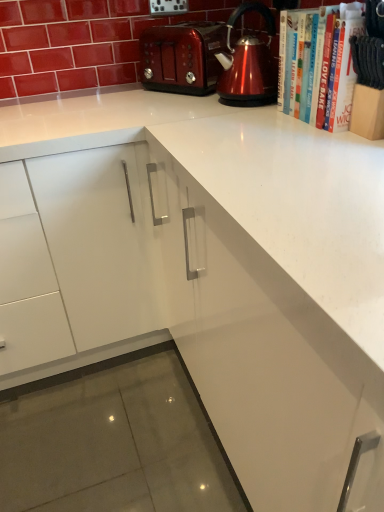
In order to click on white paper book at upper right, arranged as the first book when viewed from the front in this screenshot , I will do `click(343, 67)`.

At what (x,y) coordinates should I click in order to perform the action: click on shiny metallic toaster at upper center. Please return your answer as a coordinate pair (x, y). This screenshot has width=384, height=512. Looking at the image, I should click on (182, 57).

Where is `white paper book at upper right, the second book viewed from the back`? The image size is (384, 512). white paper book at upper right, the second book viewed from the back is located at coordinates (343, 67).

From the image's perspective, is white paper book at upper right, placed as the second book when sorted from front to back, beneath shiny metallic kettle at upper right?

Yes, from the image's perspective, white paper book at upper right, placed as the second book when sorted from front to back, is beneath shiny metallic kettle at upper right.

Is point (352, 24) positioned behind point (243, 104)?

No, it is in front of (243, 104).

Considering the positions of objects white paper book at upper right, placed as the second book when sorted from front to back, and shiny metallic kettle at upper right in the image provided, who is in front, white paper book at upper right, placed as the second book when sorted from front to back, or shiny metallic kettle at upper right?

white paper book at upper right, placed as the second book when sorted from front to back, is more forward.

Considering the sizes of objects white paper book at upper right, placed as the second book when sorted from front to back, and shiny metallic kettle at upper right in the image provided, who is taller, white paper book at upper right, placed as the second book when sorted from front to back, or shiny metallic kettle at upper right?

shiny metallic kettle at upper right.

Is white paper book at upper right, arranged as the 1th book when viewed from the back, at the left side of white paper book at upper right, the second book viewed from the back?

Indeed, white paper book at upper right, arranged as the 1th book when viewed from the back, is positioned on the left side of white paper book at upper right, the second book viewed from the back.

From the image's perspective, is white paper book at upper right, arranged as the 1th book when viewed from the back, located above or below white paper book at upper right, the second book viewed from the back?

Clearly, from the image's perspective, white paper book at upper right, arranged as the 1th book when viewed from the back, is above white paper book at upper right, the second book viewed from the back.

Does white paper book at upper right, placed as the second book when sorted from front to back, lie in front of white paper book at upper right, arranged as the first book when viewed from the front?

No, it is behind white paper book at upper right, arranged as the first book when viewed from the front.

This screenshot has height=512, width=384. Find the location of `book on the right side of white paper book at upper right, arranged as the 1th book when viewed from the back`. book on the right side of white paper book at upper right, arranged as the 1th book when viewed from the back is located at coordinates (343, 67).

Considering their positions, is shiny metallic kettle at upper right located in front of or behind white paper book at upper right, arranged as the 1th book when viewed from the back?

Visually, shiny metallic kettle at upper right is located behind white paper book at upper right, arranged as the 1th book when viewed from the back.

Considering the relative positions of shiny metallic kettle at upper right and white paper book at upper right, placed as the second book when sorted from front to back, in the image provided, is shiny metallic kettle at upper right to the left or to the right of white paper book at upper right, placed as the second book when sorted from front to back,?

shiny metallic kettle at upper right is to the left of white paper book at upper right, placed as the second book when sorted from front to back.

Is shiny metallic kettle at upper right taller than white paper book at upper right, arranged as the 1th book when viewed from the back?

Correct, shiny metallic kettle at upper right is much taller as white paper book at upper right, arranged as the 1th book when viewed from the back.

Consider the image. Based on their sizes in the image, would you say shiny metallic kettle at upper right is bigger or smaller than white paper book at upper right, arranged as the 1th book when viewed from the back?

shiny metallic kettle at upper right is smaller than white paper book at upper right, arranged as the 1th book when viewed from the back.

Would you say white paper book at upper right, arranged as the 1th book when viewed from the back, is to the left or to the right of shiny metallic toaster at upper center in the picture?

From the image, it's evident that white paper book at upper right, arranged as the 1th book when viewed from the back, is to the right of shiny metallic toaster at upper center.

Does white paper book at upper right, placed as the second book when sorted from front to back, turn towards shiny metallic toaster at upper center?

No, white paper book at upper right, placed as the second book when sorted from front to back, is not oriented towards shiny metallic toaster at upper center.

Which is more distant, [319,120] or [177,29]?

The point [177,29] is farther from the camera.

Based on the photo, from the image's perspective, is white paper book at upper right, placed as the second book when sorted from front to back, beneath shiny metallic toaster at upper center?

Indeed, from the image's perspective, white paper book at upper right, placed as the second book when sorted from front to back, is shown beneath shiny metallic toaster at upper center.

From the image's perspective, who appears lower, shiny metallic kettle at upper right or white paper book at upper right, arranged as the first book when viewed from the front?

From the image's view, white paper book at upper right, arranged as the first book when viewed from the front, is below.

Would you consider shiny metallic kettle at upper right to be distant from white paper book at upper right, the second book viewed from the back?

No.

From a real-world perspective, is shiny metallic kettle at upper right positioned above or below white paper book at upper right, arranged as the first book when viewed from the front?

Clearly, from a real-world perspective, shiny metallic kettle at upper right is below white paper book at upper right, arranged as the first book when viewed from the front.

Is point (276, 77) positioned in front of point (341, 17)?

No, it is behind (341, 17).

Considering the relative sizes of white paper book at upper right, arranged as the first book when viewed from the front, and white paper book at upper right, placed as the second book when sorted from front to back, in the image provided, is white paper book at upper right, arranged as the first book when viewed from the front, thinner than white paper book at upper right, placed as the second book when sorted from front to back,?

Indeed, white paper book at upper right, arranged as the first book when viewed from the front, has a lesser width compared to white paper book at upper right, placed as the second book when sorted from front to back.

Does point (327, 112) come behind point (295, 25)?

No, (327, 112) is closer to viewer.

From the image's perspective, is white paper book at upper right, the second book viewed from the back, beneath white paper book at upper right, arranged as the 1th book when viewed from the back?

Yes, from the image's perspective, white paper book at upper right, the second book viewed from the back, is beneath white paper book at upper right, arranged as the 1th book when viewed from the back.

Is white paper book at upper right, arranged as the first book when viewed from the front, directly adjacent to white paper book at upper right, arranged as the 1th book when viewed from the back?

Yes.

Does point (332, 103) appear closer or farther from the camera than point (240, 63)?

Point (332, 103) is positioned closer to the camera compared to point (240, 63).

You are a GUI agent. You are given a task and a screenshot of the screen. Output one action in this format:
    pyautogui.click(x=<x>, y=<y>)
    Task: Click on the book that is above the shiny metallic kettle at upper right (from a real-world perspective)
    The height and width of the screenshot is (512, 384).
    Given the screenshot: What is the action you would take?
    pyautogui.click(x=343, y=67)

Between white paper book at upper right, the second book viewed from the back, and shiny metallic kettle at upper right, which one appears on the left side from the viewer's perspective?

shiny metallic kettle at upper right is more to the left.

There is a white paper book at upper right, placed as the second book when sorted from front to back. In order to click on kettle above it (from a real-world perspective) in this screenshot , I will do pyautogui.click(x=248, y=63).

Locate an element on the screen. Image resolution: width=384 pixels, height=512 pixels. book lying below the white paper book at upper right, arranged as the 1th book when viewed from the back (from the image's perspective) is located at coordinates (343, 67).

From the image, which object appears to be nearer to white paper book at upper right, the second book viewed from the back, shiny metallic toaster at upper center or shiny metallic kettle at upper right?

shiny metallic kettle at upper right lies closer to white paper book at upper right, the second book viewed from the back, than the other object.

Which object lies nearer to the anchor point shiny metallic toaster at upper center, shiny metallic kettle at upper right or white paper book at upper right, arranged as the first book when viewed from the front?

Based on the image, shiny metallic kettle at upper right appears to be nearer to shiny metallic toaster at upper center.

Looking at the image, which one is located closer to white paper book at upper right, arranged as the first book when viewed from the front, shiny metallic kettle at upper right or shiny metallic toaster at upper center?

shiny metallic kettle at upper right lies closer to white paper book at upper right, arranged as the first book when viewed from the front, than the other object.

Estimate the real-world distances between objects in this image. Which object is further from white paper book at upper right, placed as the second book when sorted from front to back, shiny metallic toaster at upper center or white paper book at upper right, arranged as the first book when viewed from the front?

shiny metallic toaster at upper center is positioned further to the anchor white paper book at upper right, placed as the second book when sorted from front to back.

When comparing their distances from white paper book at upper right, placed as the second book when sorted from front to back, does shiny metallic kettle at upper right or white paper book at upper right, the second book viewed from the back, seem closer?

white paper book at upper right, the second book viewed from the back, is positioned closer to the anchor white paper book at upper right, placed as the second book when sorted from front to back.

When comparing their distances from shiny metallic kettle at upper right, does shiny metallic toaster at upper center or white paper book at upper right, arranged as the 1th book when viewed from the back, seem closer?

Based on the image, white paper book at upper right, arranged as the 1th book when viewed from the back, appears to be nearer to shiny metallic kettle at upper right.

Based on their spatial positions, is white paper book at upper right, placed as the second book when sorted from front to back, or white paper book at upper right, arranged as the first book when viewed from the front, closer to shiny metallic kettle at upper right?

Among the two, white paper book at upper right, placed as the second book when sorted from front to back, is located nearer to shiny metallic kettle at upper right.

Based on their spatial positions, is shiny metallic kettle at upper right or shiny metallic toaster at upper center further from white paper book at upper right, placed as the second book when sorted from front to back?

Based on the image, shiny metallic toaster at upper center appears to be further to white paper book at upper right, placed as the second book when sorted from front to back.

Find the location of a particular element. Image resolution: width=384 pixels, height=512 pixels. kettle positioned between white paper book at upper right, arranged as the first book when viewed from the front, and shiny metallic toaster at upper center from near to far is located at coordinates (248, 63).

Identify the location of book positioned between white paper book at upper right, arranged as the first book when viewed from the front, and shiny metallic kettle at upper right from near to far. Image resolution: width=384 pixels, height=512 pixels. (311, 57).

This screenshot has height=512, width=384. Find the location of `kettle between white paper book at upper right, arranged as the 1th book when viewed from the back, and shiny metallic toaster at upper center, along the z-axis`. kettle between white paper book at upper right, arranged as the 1th book when viewed from the back, and shiny metallic toaster at upper center, along the z-axis is located at coordinates click(x=248, y=63).

Find the location of a particular element. The height and width of the screenshot is (512, 384). book located between white paper book at upper right, arranged as the first book when viewed from the front, and shiny metallic toaster at upper center in the depth direction is located at coordinates (311, 57).